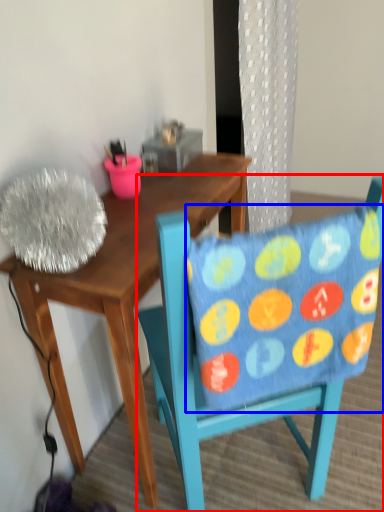
Question: Among these objects, which one is nearest to the camera, chair (highlighted by a red box) or pillow (highlighted by a blue box)?

Choices:
 (A) chair
 (B) pillow

Answer: (B)